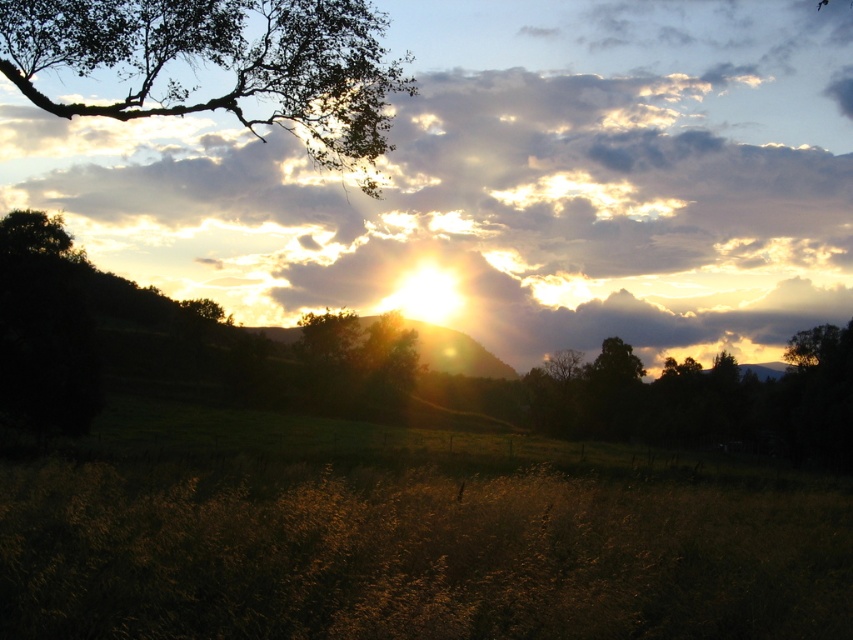
In the scene shown: You are standing in the middle of the field and want to take a photo of both the green leafy tree at upper left and the green matte tree at center. Which tree should you position to your left to include both in the frame?

You should position the green leafy tree at upper left to your left because it is already on the left side of the green matte tree at center, so placing it to your left will keep both trees within the camera frame.

You are an artist setting up your easel to paint the landscape. You want to capture both the green leafy tree at upper left and the green matte tree at center in your painting. Which tree should you focus on first if you want to paint the larger one first?

The green leafy tree at upper left is larger in size than the green matte tree at center, so you should focus on painting the green leafy tree at upper left first.